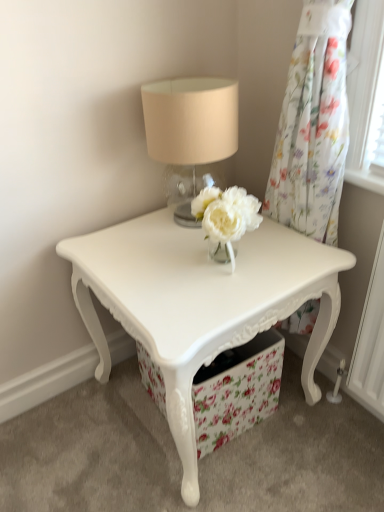
Question: Is floral sheer curtain at upper right shorter than matte glass table lamp at upper center?

Choices:
 (A) yes
 (B) no

Answer: (B)

Question: Would you say floral sheer curtain at upper right contains matte glass table lamp at upper center?

Choices:
 (A) no
 (B) yes

Answer: (A)

Question: Does floral sheer curtain at upper right have a smaller size compared to matte glass table lamp at upper center?

Choices:
 (A) yes
 (B) no

Answer: (B)

Question: From a real-world perspective, is floral sheer curtain at upper right over matte glass table lamp at upper center?

Choices:
 (A) no
 (B) yes

Answer: (A)

Question: Is floral sheer curtain at upper right facing towards matte glass table lamp at upper center?

Choices:
 (A) no
 (B) yes

Answer: (A)

Question: Would you say floral fabric drawer at center is inside or outside white glossy table at center?

Choices:
 (A) outside
 (B) inside

Answer: (B)

Question: From the image's perspective, relative to white glossy table at center, is floral fabric drawer at center above or below?

Choices:
 (A) below
 (B) above

Answer: (A)

Question: Is point (206, 445) positioned closer to the camera than point (115, 250)?

Choices:
 (A) farther
 (B) closer

Answer: (A)

Question: From a real-world perspective, is floral fabric drawer at center positioned above or below white glossy table at center?

Choices:
 (A) below
 (B) above

Answer: (A)

Question: Is white glossy table at center in front of or behind matte glass table lamp at upper center in the image?

Choices:
 (A) behind
 (B) front

Answer: (B)

Question: Would you say white glossy table at center is inside or outside matte glass table lamp at upper center?

Choices:
 (A) inside
 (B) outside

Answer: (B)

Question: Does point (336, 276) appear closer or farther from the camera than point (178, 173)?

Choices:
 (A) farther
 (B) closer

Answer: (B)

Question: In terms of height, does white glossy table at center look taller or shorter compared to matte glass table lamp at upper center?

Choices:
 (A) tall
 (B) short

Answer: (A)

Question: Considering the positions of white glossy table at center and floral sheer curtain at upper right in the image, is white glossy table at center taller or shorter than floral sheer curtain at upper right?

Choices:
 (A) tall
 (B) short

Answer: (B)

Question: Visually, is white glossy table at center positioned to the left or to the right of floral sheer curtain at upper right?

Choices:
 (A) right
 (B) left

Answer: (B)